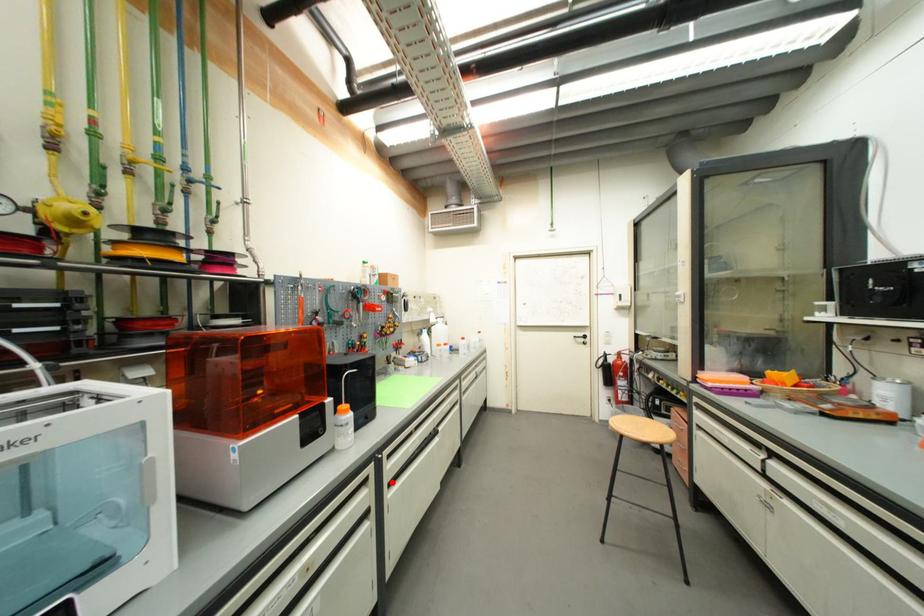
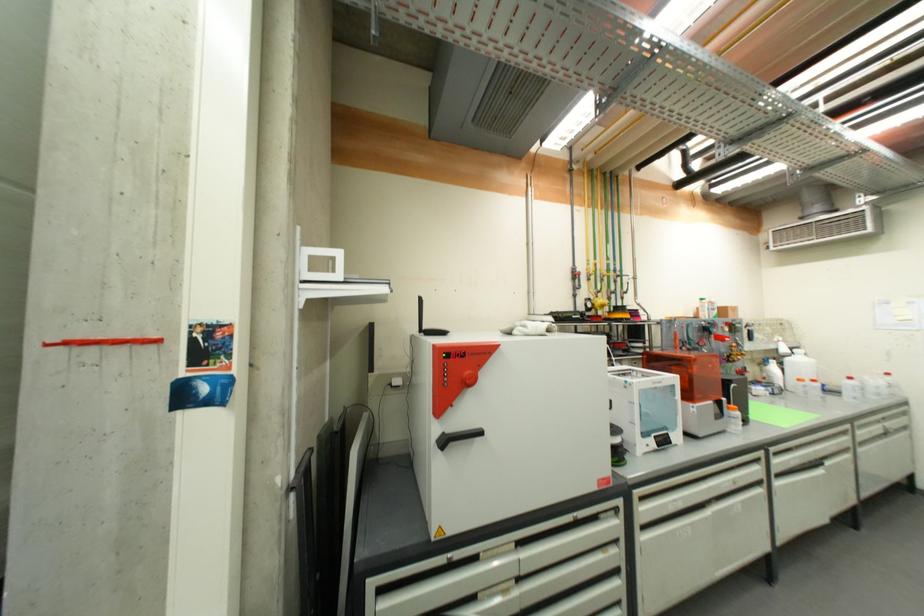
Question: A red point is marked in image1. In image2, is the corresponding 3D point closer to the camera or farther? Reply with the corresponding letter.

Choices:
 (A) The corresponding 3D point is closer.
 (B) The corresponding 3D point is farther.

Answer: (A)